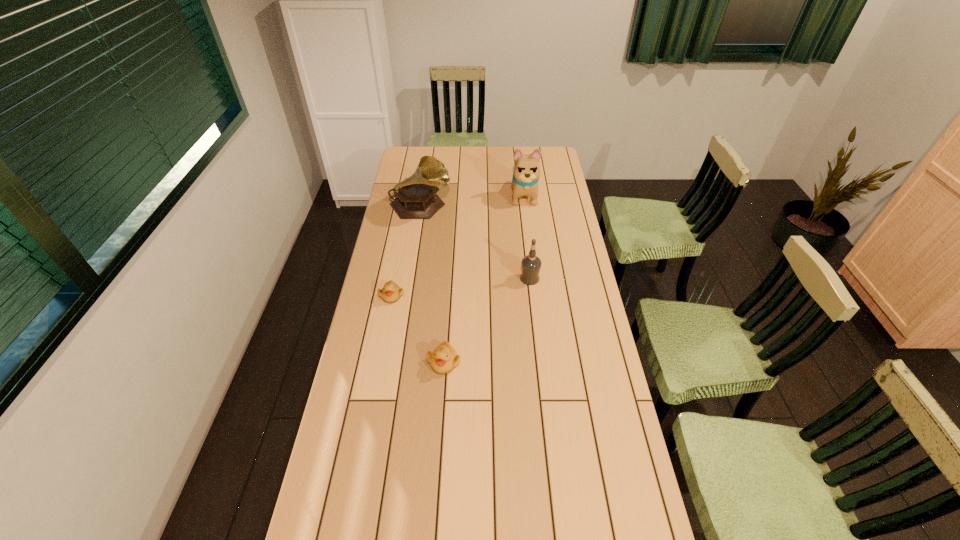
I want to click on puppy, so click(526, 173).

Where is `phonograph record`? Image resolution: width=960 pixels, height=540 pixels. phonograph record is located at coordinates (416, 198).

Locate an element on the screen. The height and width of the screenshot is (540, 960). the third nearest object is located at coordinates (531, 264).

Identify the location of vodka. This screenshot has width=960, height=540. (531, 264).

At what (x,y) coordinates should I click in order to perform the action: click on the nearer duckling. Please return your answer as a coordinate pair (x, y). Looking at the image, I should click on (443, 359).

You are a GUI agent. You are given a task and a screenshot of the screen. Output one action in this format:
    pyautogui.click(x=<x>, y=<y>)
    Task: Click on the nearest object
    The height and width of the screenshot is (540, 960).
    Given the screenshot: What is the action you would take?
    (443, 359)

I want to click on the second nearest object, so click(x=391, y=292).

In order to click on the shortest object in this screenshot , I will do `click(391, 292)`.

This screenshot has width=960, height=540. I want to click on vacant region located on the face of the puppy, so click(x=531, y=252).

Where is `vacant space located on the horn direction of the phonograph record`? The image size is (960, 540). vacant space located on the horn direction of the phonograph record is located at coordinates (473, 207).